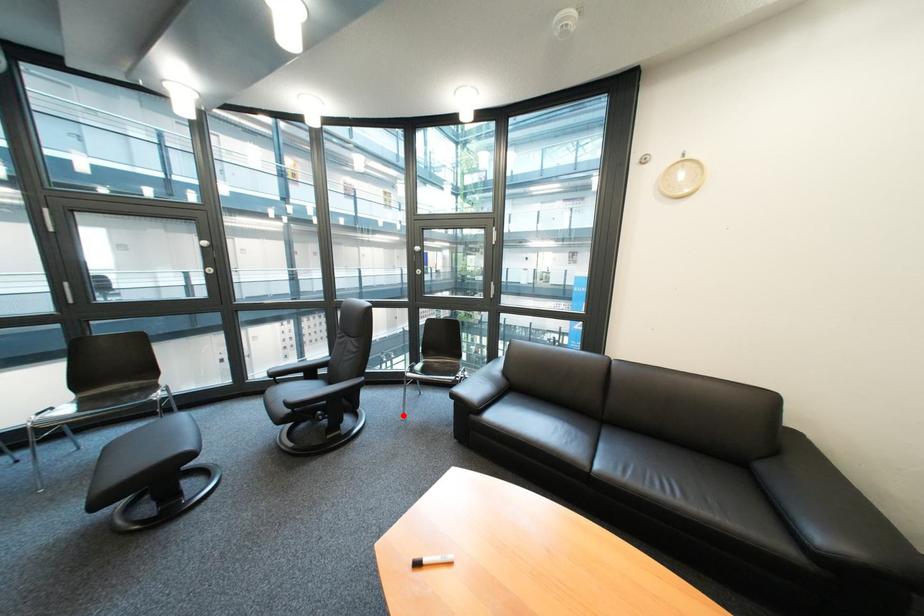
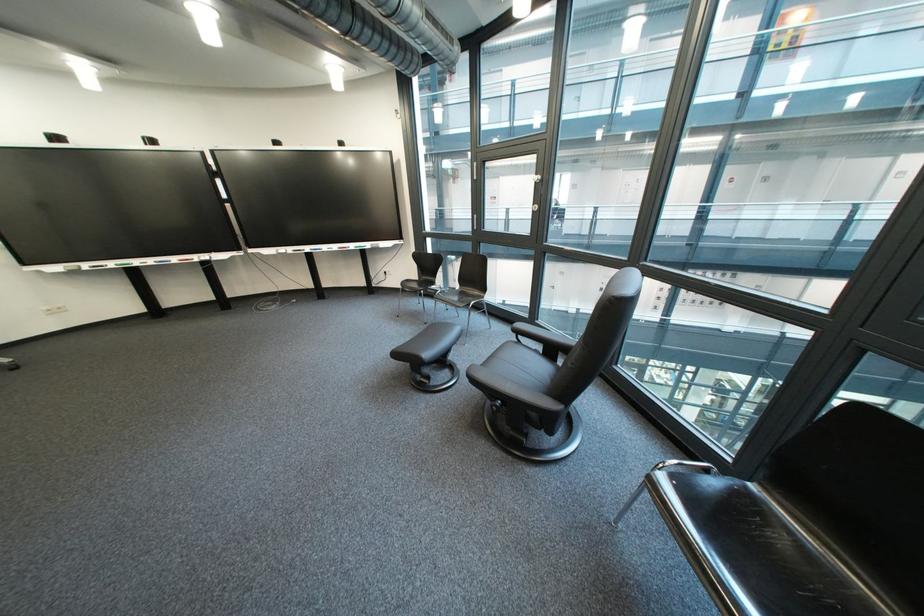
Where in the second image is the point corresponding to the highlighted location from the first image?

(622, 488)